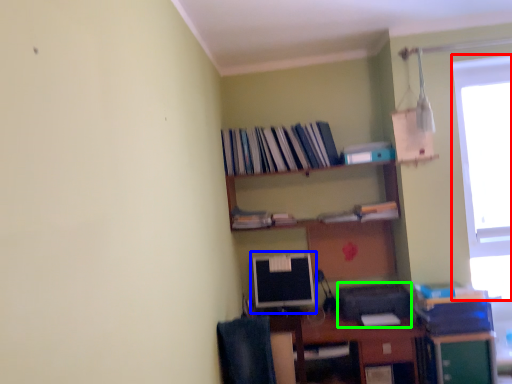
Question: Based on their relative distances, which object is nearer to window (highlighted by a red box)? Choose from computer monitor (highlighted by a blue box) and printer (highlighted by a green box).

Choices:
 (A) computer monitor
 (B) printer

Answer: (B)